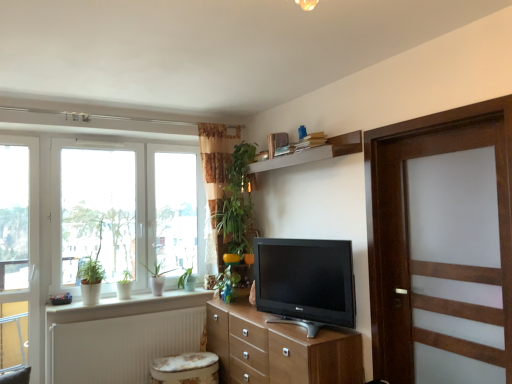
Locate an element on the screen. This screenshot has width=512, height=384. free region under green glossy plant at center, which is the 2th plant in left-to-right order (from a real-world perspective) is located at coordinates (225, 304).